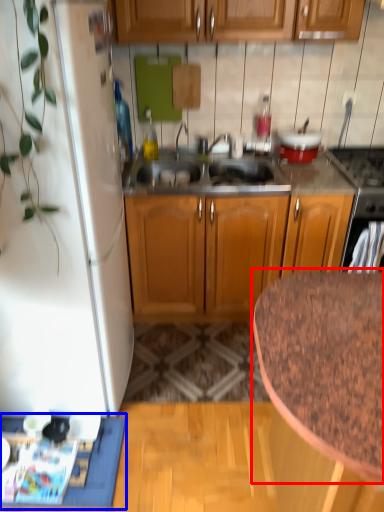
Question: Which object is further to the camera taking this photo, countertop (highlighted by a red box) or doormat (highlighted by a blue box)?

Choices:
 (A) countertop
 (B) doormat

Answer: (B)